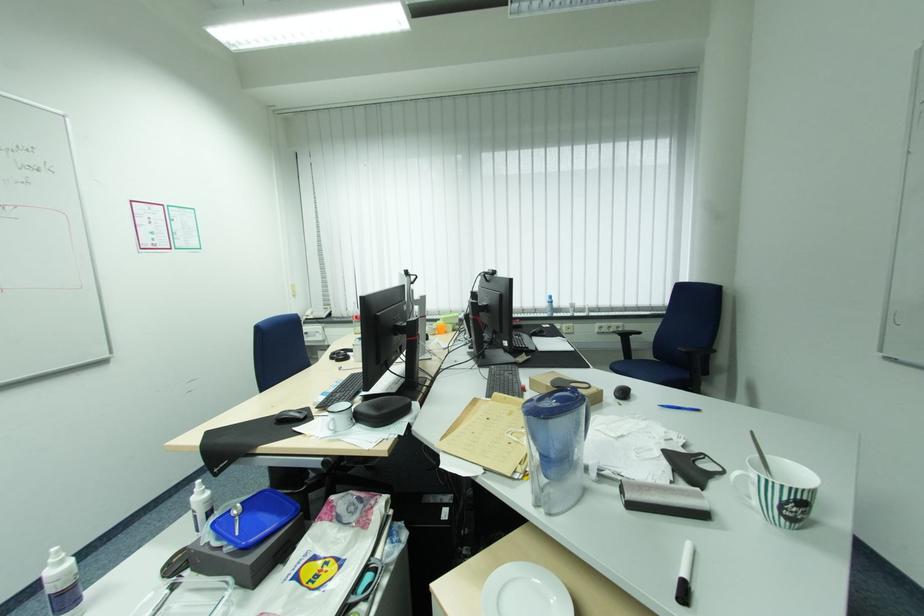
Find where to lift the white ceramic plate. Please return your answer as a coordinate pair (x, y).

(525, 592)